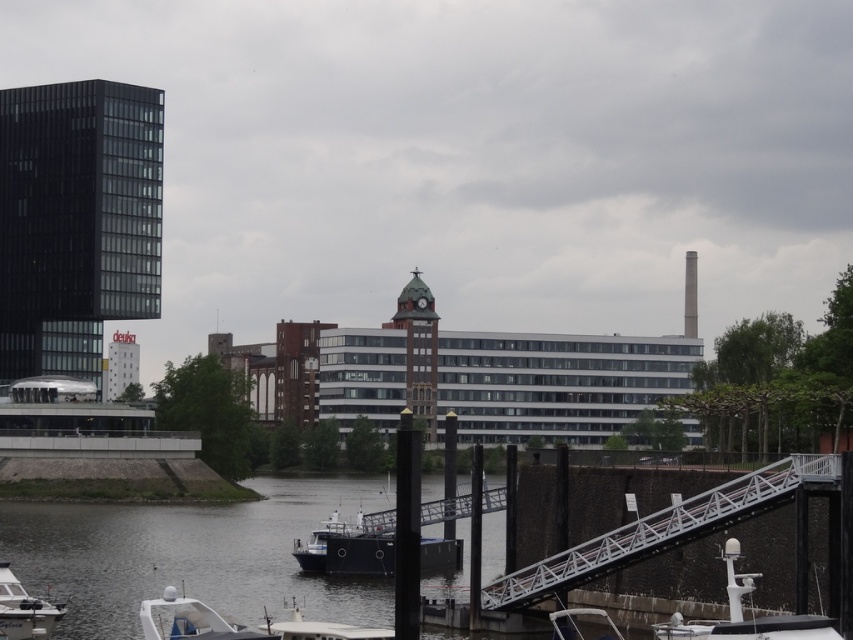
Does dark blue water at center come behind white metal dock at lower right?

No, it is in front of white metal dock at lower right.

Which is more to the left, dark blue water at center or white metal dock at lower right?

From the viewer's perspective, dark blue water at center appears more on the left side.

Between point (451, 636) and point (833, 481), which one is positioned behind?

Point (451, 636)

Where is `dark blue water at center`? This screenshot has width=853, height=640. dark blue water at center is located at coordinates (190, 556).

Image resolution: width=853 pixels, height=640 pixels. Describe the element at coordinates (350, 547) in the screenshot. I see `blue matte boat at lower center` at that location.

Which is in front, point (341, 522) or point (148, 634)?

Point (148, 634) is in front.

Where is `blue matte boat at lower center`? Image resolution: width=853 pixels, height=640 pixels. blue matte boat at lower center is located at coordinates (350, 547).

Can you confirm if white matte radar at lower right is positioned above white plastic boat at lower left?

Indeed, white matte radar at lower right is positioned over white plastic boat at lower left.

Is point (798, 609) less distant than point (0, 625)?

Yes.

Where is `white matte radar at lower right`? white matte radar at lower right is located at coordinates (741, 614).